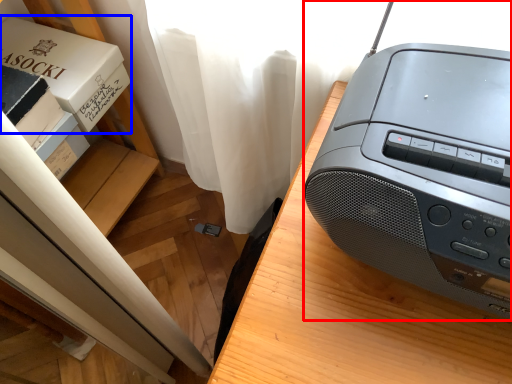
Question: Which point is further to the camera, printer (highlighted by a red box) or paperback book (highlighted by a blue box)?

Choices:
 (A) printer
 (B) paperback book

Answer: (B)